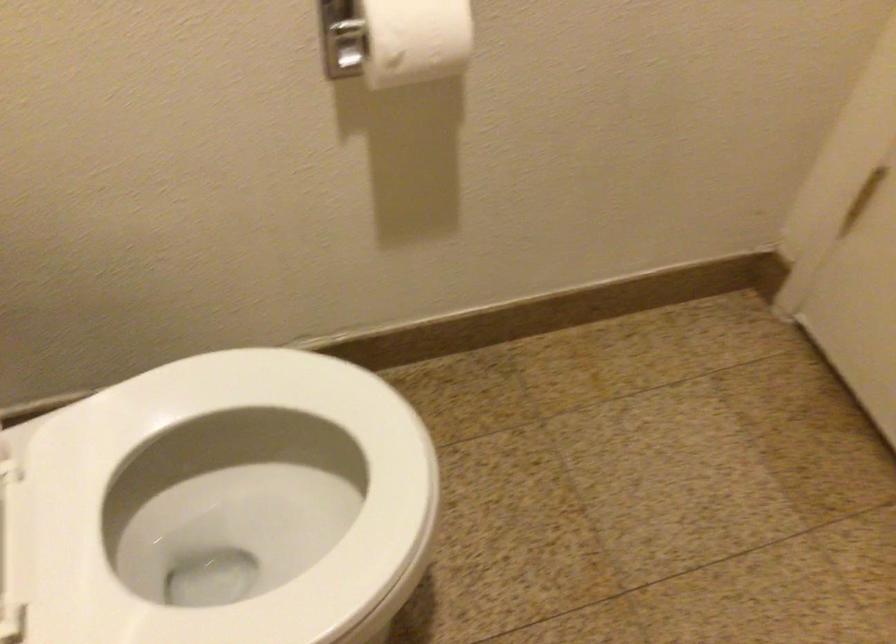
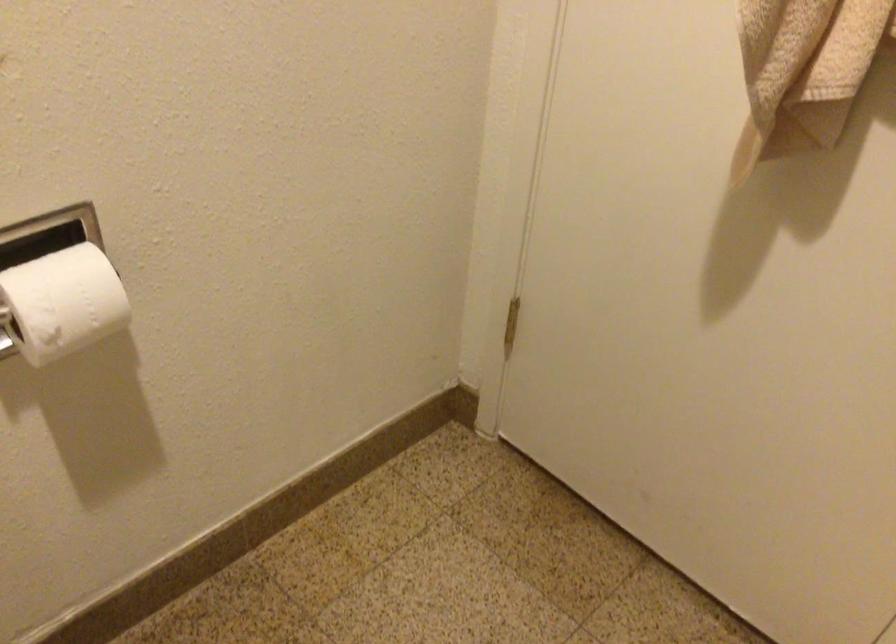
Question: The images are taken continuously from a first-person perspective. In which direction is your viewpoint rotating?

Choices:
 (A) Left
 (B) Right
 (C) Up
 (D) Down

Answer: (B)